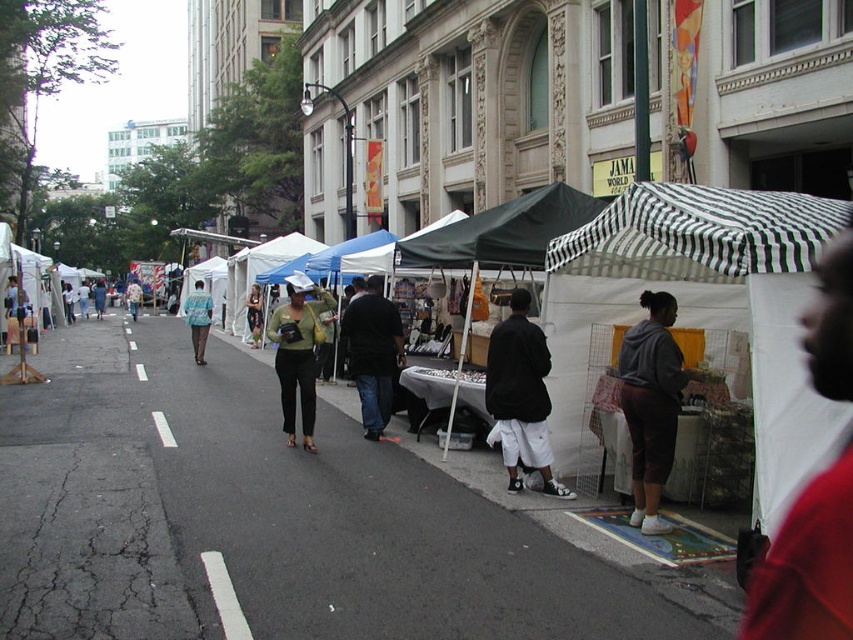
Question: Can you confirm if black fabric canopy at center is positioned to the left of matte blue shirt at center?

Choices:
 (A) no
 (B) yes

Answer: (A)

Question: Which of these objects is positioned farthest from the black and white striped tent at right?

Choices:
 (A) matte green blouse at center
 (B) matte blue shirt at center
 (C) red shirt at center
 (D) black cotton pants at lower center

Answer: (B)

Question: Is dark blue jeans at center positioned before green fabric purse at center?

Choices:
 (A) no
 (B) yes

Answer: (B)

Question: Which of the following is the closest to the observer?

Choices:
 (A) black and white striped canopy at right
 (B) black cotton pants at lower center
 (C) green fabric purse at center
 (D) matte blue shirt at center

Answer: (A)

Question: Which point appears farthest from the camera in this image?

Choices:
 (A) (527, 323)
 (B) (781, 515)
 (C) (386, 394)

Answer: (C)

Question: Is black and white striped canopy at right further to camera compared to black cotton pants at lower center?

Choices:
 (A) yes
 (B) no

Answer: (B)